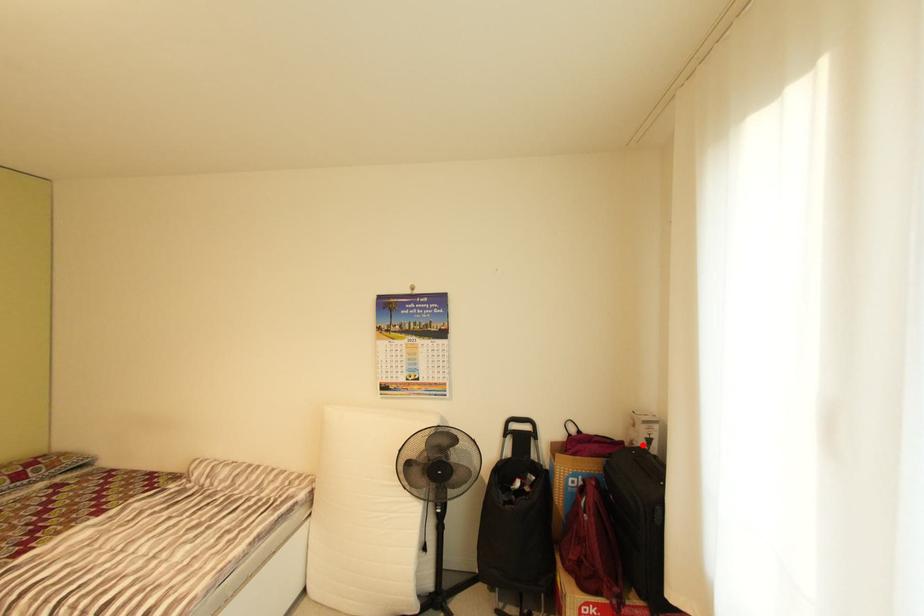
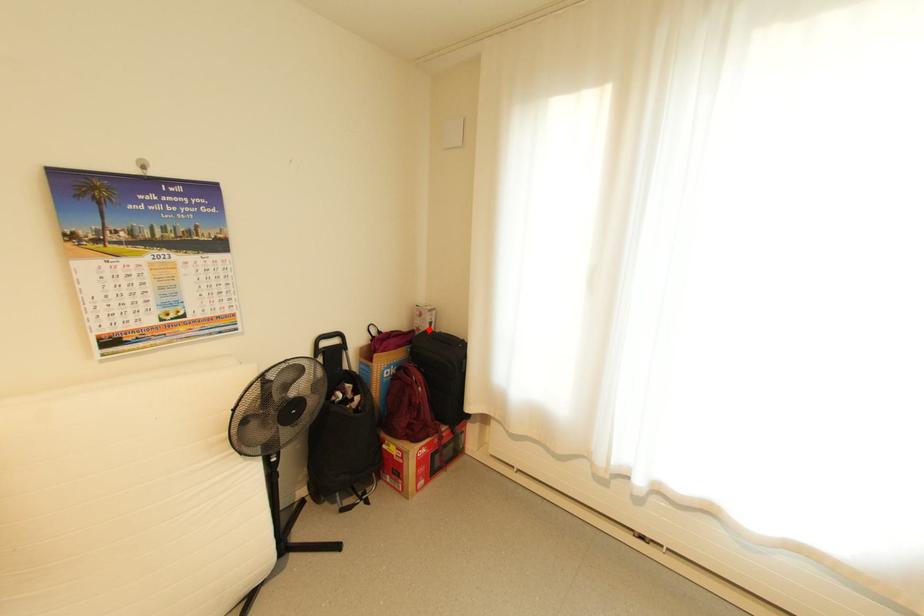
In the scene shown: I am providing you with two images of the same scene from different viewpoints. A red point is marked on the first image and another point is marked on the second image. Is the red point in image1 aligned with the point shown in image2?

Yes